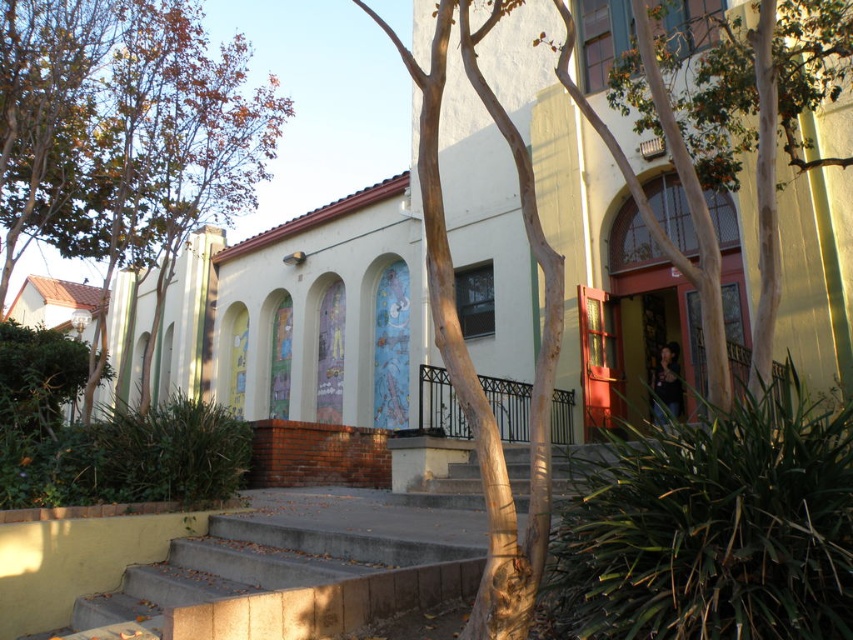
You are standing in front of the building and want to take a photo of the brown leafy tree at upper left. The camera you are using has a maximum focus range of 35 feet. Will the tree be in focus?

The brown leafy tree at upper left is 34.95 feet from viewer, which is within the camera maximum focus range of 35 feet. So the tree will be in focus.

You are standing in front of the building and notice a point marked at coordinates (x=126, y=138). What object is located at that point?

The point at coordinates (x=126, y=138) corresponds to the brown leafy tree at upper left.